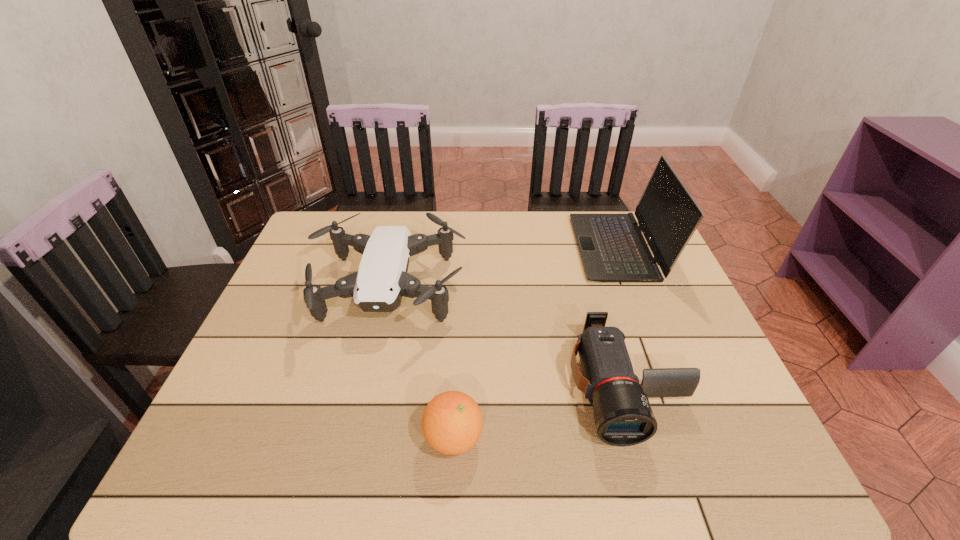
Find the location of a particular element. The width and height of the screenshot is (960, 540). free point between the tallest object and the drone is located at coordinates (504, 269).

Identify the location of free space between the drone and the orange. The image size is (960, 540). 421,364.

The width and height of the screenshot is (960, 540). I want to click on vacant area that lies between the camcorder and the orange, so click(540, 412).

Identify the location of free spot between the laptop computer and the camcorder. click(x=622, y=317).

Choose which object is the second nearest neighbor to the tallest object. Please provide its 2D coordinates. Your answer should be formatted as a tuple, i.e. [(x, y)], where the tuple contains the x and y coordinates of a point satisfying the conditions above.

[(378, 286)]

Where is `object that is the closest one to the camcorder`? The image size is (960, 540). object that is the closest one to the camcorder is located at coordinates (452, 422).

You are a GUI agent. You are given a task and a screenshot of the screen. Output one action in this format:
    pyautogui.click(x=<x>, y=<y>)
    Task: Click on the free space that satisfies the following two spatial constraints: 1. on the screen of the tallest object; 2. on the lens of the camcorder
    The image size is (960, 540).
    Given the screenshot: What is the action you would take?
    pyautogui.click(x=673, y=386)

Locate an element on the screen. This screenshot has height=540, width=960. free spot that satisfies the following two spatial constraints: 1. on the screen of the tallest object; 2. on the lens of the camcorder is located at coordinates (673, 386).

I want to click on free location that satisfies the following two spatial constraints: 1. on the screen of the laptop computer; 2. on the lens of the camcorder, so click(673, 386).

Locate an element on the screen. Image resolution: width=960 pixels, height=540 pixels. vacant space that satisfies the following two spatial constraints: 1. on the screen of the laptop computer; 2. on the camera side of the second tallest object is located at coordinates (636, 290).